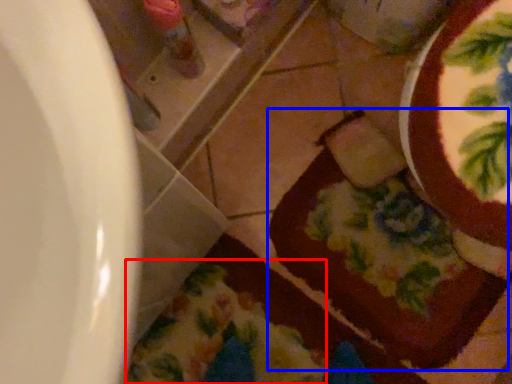
Question: Which object appears farthest to the camera in this image, blanket (highlighted by a red box) or chocolate cake (highlighted by a blue box)?

Choices:
 (A) blanket
 (B) chocolate cake

Answer: (B)